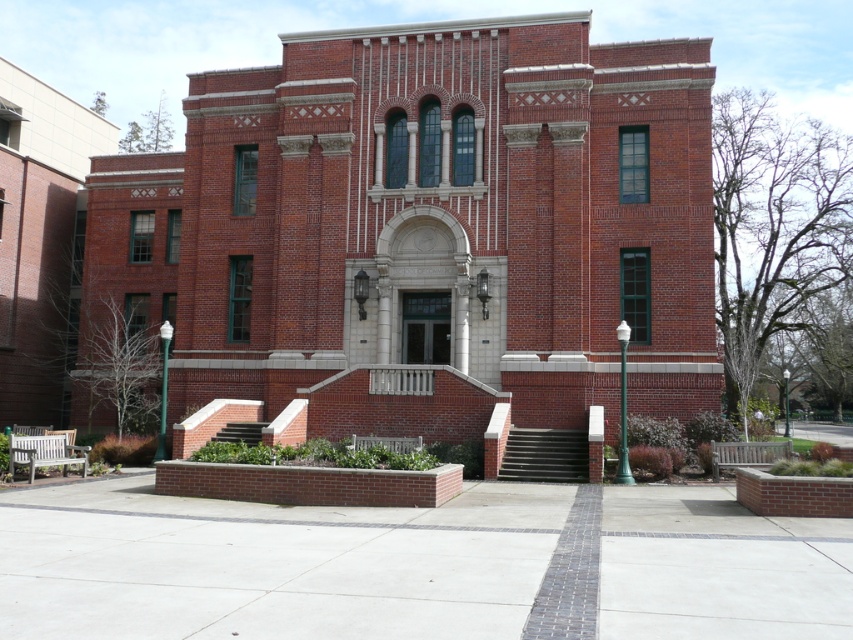
Question: Where is green metal lamp post at center located in relation to brown brick stairs at center in the image?

Choices:
 (A) below
 (B) above

Answer: (A)

Question: Is green metal lamp post at center positioned at the back of green polished metal lamp post at left?

Choices:
 (A) yes
 (B) no

Answer: (B)

Question: Which point is closer to the camera taking this photo?

Choices:
 (A) (212, 436)
 (B) (656, 628)
 (C) (167, 346)
 (D) (561, 458)

Answer: (B)

Question: Which object is closer to the camera taking this photo?

Choices:
 (A) black concrete stairs at center
 (B) green metal lamp post at center
 (C) green polished metal lamp post at left
 (D) brown brick stairs at center

Answer: (B)

Question: Does concrete at center appear over green polished metal lamp post at left?

Choices:
 (A) no
 (B) yes

Answer: (A)

Question: Which point is closer to the camera taking this photo?

Choices:
 (A) (164, 346)
 (B) (560, 456)

Answer: (B)